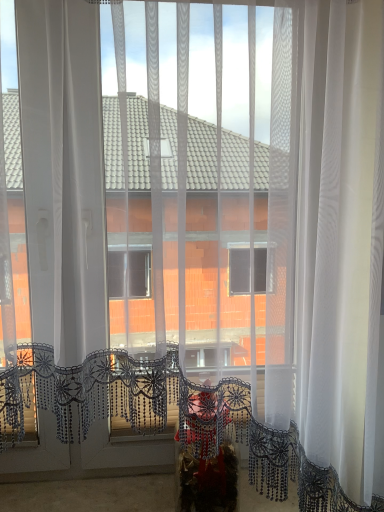
Locate an element on the screen. velvet red chair at center is located at coordinates (211, 442).

Describe the element at coordinates (211, 442) in the screenshot. I see `velvet red chair at center` at that location.

Find the location of a particular element. This screenshot has height=512, width=384. velvet red chair at center is located at coordinates (211, 442).